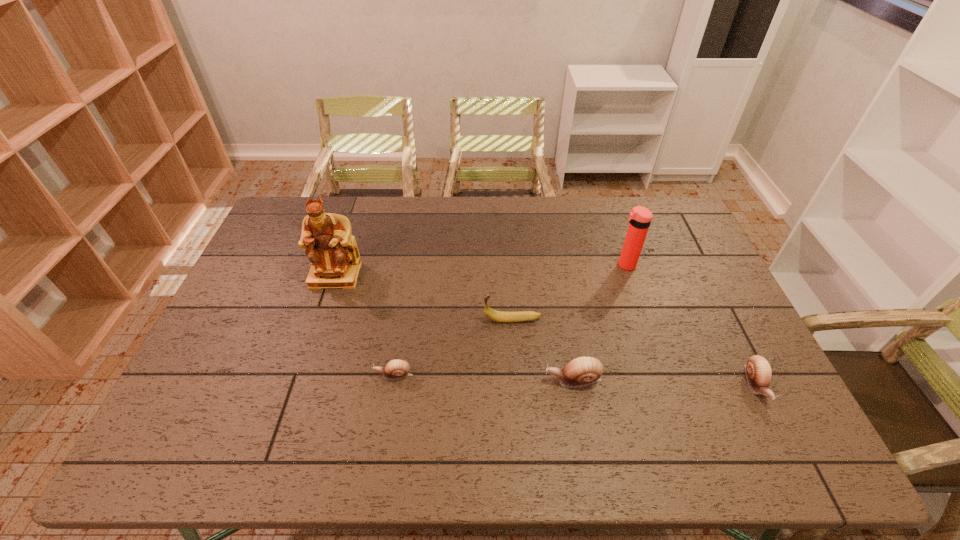
This screenshot has width=960, height=540. I want to click on the closest escargot relative to the second tallest object, so click(758, 371).